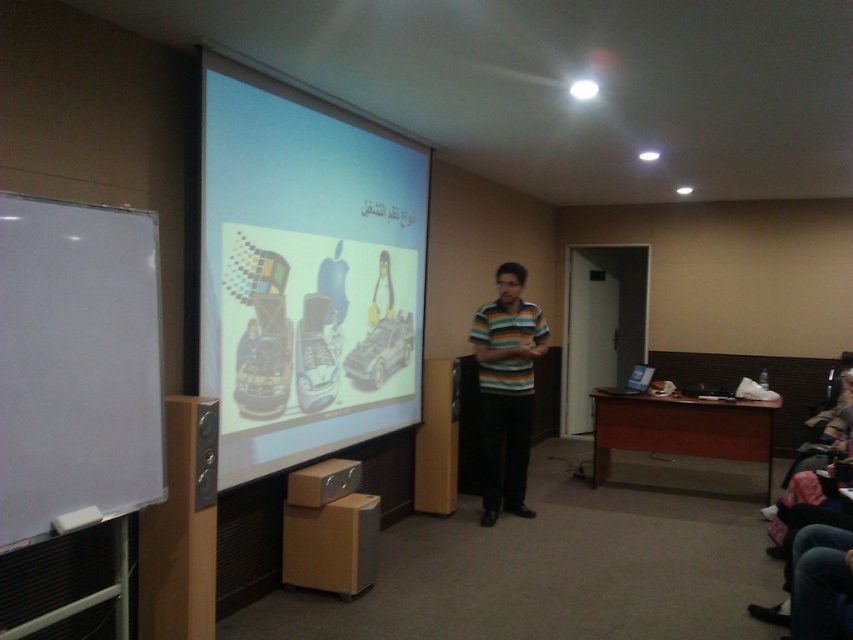
You are an attendee at the presentation and need to take a photo of the white matte projection screen at center. You are currently standing 1.5 meters away from the striped cotton shirt at center. Can you take the photo without moving closer to the screen?

The white matte projection screen at center is 1.06 meters from the striped cotton shirt at center. Since you are 1.5 meters away from the shirt, you are 2.56 meters away from the screen. This distance may be too far for a clear photo, so moving closer would improve the quality.

You are an attendee at the presentation. The presenter is standing in front of the white matte projection screen at center and the striped cotton shirt at center. Which object is closer to you?

The white matte projection screen at center is closer to you since it is in front of the striped cotton shirt at center.

You are an event organizer planning to set up a new projector. The projector requires the screen to be at least twice the size of the presenter wearing the striped cotton shirt at center. Based on the scene, will the white matte projection screen at center meet this requirement?

The white matte projection screen at center is larger in size than striped cotton shirt at center, but it is not specified how much larger. Since the requirement is to be at least twice the size, we cannot confirm if it meets the requirement without exact measurements.